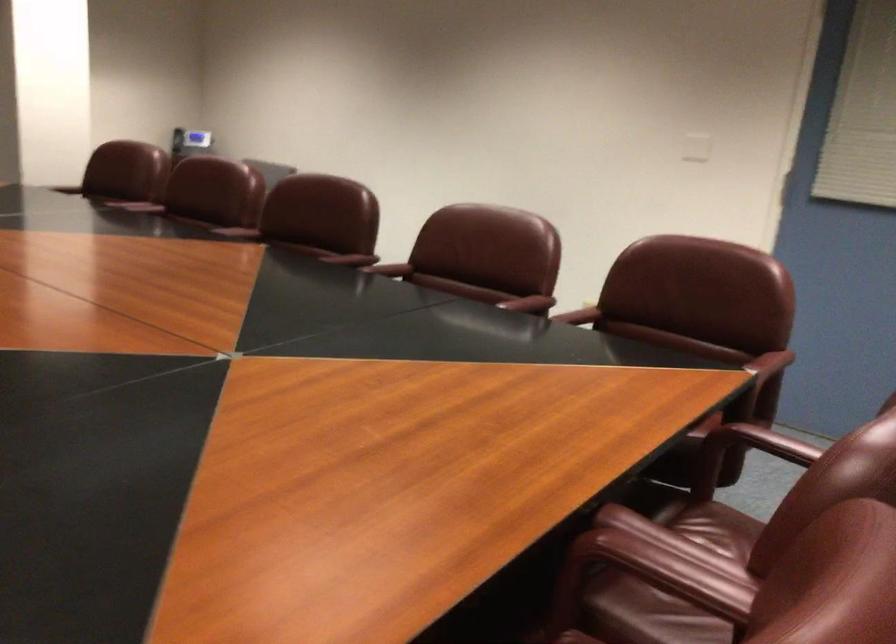
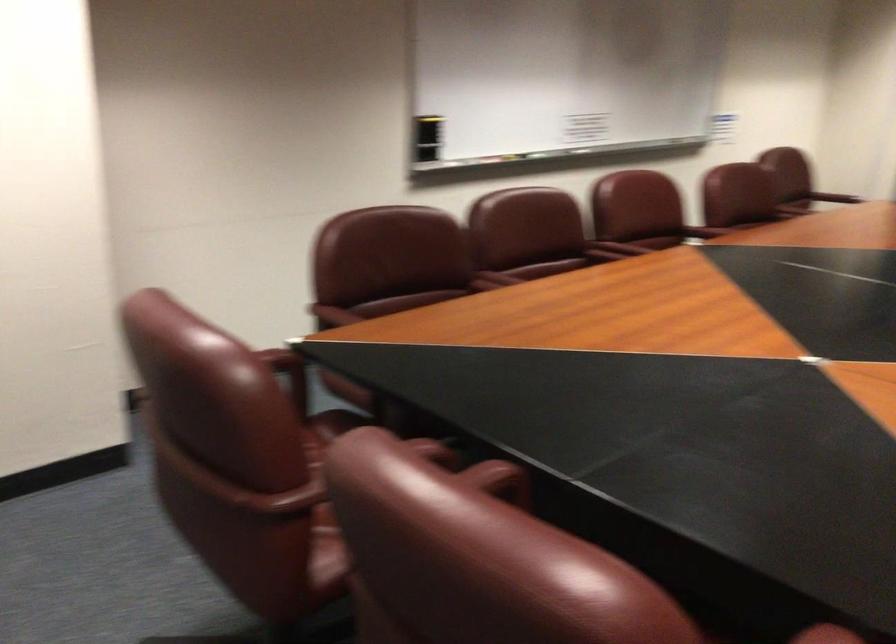
In the second image, find the point that corresponds to pixel 719 576 in the first image.

(497, 277)